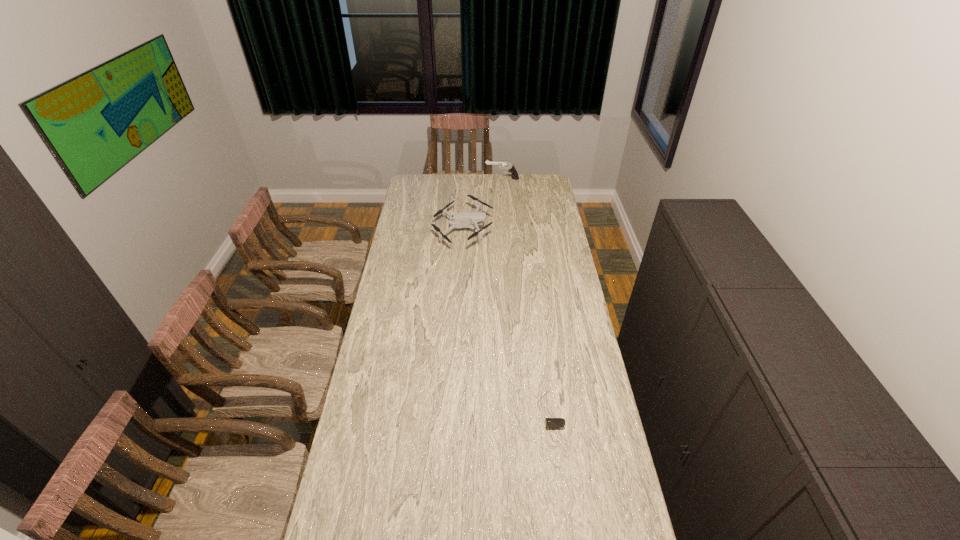
Locate an element on the screen. This screenshot has width=960, height=540. vacant region located 0.270m on the front-facing side of the shortest object is located at coordinates (563, 514).

Identify the location of object at the far edge. (511, 168).

This screenshot has width=960, height=540. In order to click on object located in the right edge section of the desktop in this screenshot , I will do `click(550, 422)`.

Find the location of a particular element. free region at the far edge of the desktop is located at coordinates (524, 193).

Identify the location of free region at the left edge. The height and width of the screenshot is (540, 960). (389, 286).

In the image, there is a desktop. Identify the location of free space at the right edge. (604, 530).

You are a GUI agent. You are given a task and a screenshot of the screen. Output one action in this format:
    pyautogui.click(x=<x>, y=<y>)
    Task: Click on the vacant space that's between the webcam and the gun
    This screenshot has height=540, width=960.
    Given the screenshot: What is the action you would take?
    click(525, 291)

Locate an element on the screen. Image resolution: width=960 pixels, height=540 pixels. vacant point located between the nearest object and the second shortest object is located at coordinates (506, 317).

Image resolution: width=960 pixels, height=540 pixels. I want to click on free space between the second farthest object and the gun, so click(483, 205).

The width and height of the screenshot is (960, 540). What are the coordinates of `vacant space that's between the second shortest object and the tallest object` in the screenshot? It's located at (483, 205).